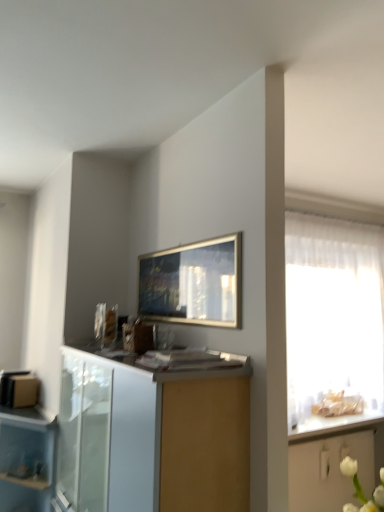
Question: Is white glossy countertop at right completely or partially inside transparent plastic drawer at lower left?

Choices:
 (A) yes
 (B) no

Answer: (B)

Question: Is transparent plastic drawer at lower left next to white glossy countertop at right?

Choices:
 (A) yes
 (B) no

Answer: (B)

Question: Does transparent plastic drawer at lower left appear on the left side of white glossy countertop at right?

Choices:
 (A) yes
 (B) no

Answer: (A)

Question: Does transparent plastic drawer at lower left come behind white glossy countertop at right?

Choices:
 (A) no
 (B) yes

Answer: (A)

Question: Does transparent plastic drawer at lower left have a greater height compared to white glossy countertop at right?

Choices:
 (A) no
 (B) yes

Answer: (B)

Question: From the image's perspective, is transparent plastic drawer at lower left under white glossy countertop at right?

Choices:
 (A) yes
 (B) no

Answer: (A)

Question: Is white glossy cabinet at lower center, the 1th cabinetry in the left-to-right sequence, smaller than white glossy countertop at right?

Choices:
 (A) yes
 (B) no

Answer: (B)

Question: Considering the relative sizes of white glossy cabinet at lower center, the second cabinetry from the bottom, and white glossy countertop at right in the image provided, is white glossy cabinet at lower center, the second cabinetry from the bottom, shorter than white glossy countertop at right?

Choices:
 (A) yes
 (B) no

Answer: (B)

Question: From the image's perspective, is white glossy cabinet at lower center, acting as the 1th cabinetry starting from the top, over white glossy countertop at right?

Choices:
 (A) yes
 (B) no

Answer: (A)

Question: Considering the relative positions of white glossy cabinet at lower center, the second cabinetry from the bottom, and white glossy countertop at right in the image provided, is white glossy cabinet at lower center, the second cabinetry from the bottom, behind white glossy countertop at right?

Choices:
 (A) no
 (B) yes

Answer: (A)

Question: Is white glossy cabinet at lower center, acting as the 1th cabinetry starting from the top, taller than white glossy countertop at right?

Choices:
 (A) no
 (B) yes

Answer: (B)

Question: Considering the relative sizes of white glossy cabinet at lower center, which appears as the 1th cabinetry when viewed from the front, and white glossy countertop at right in the image provided, is white glossy cabinet at lower center, which appears as the 1th cabinetry when viewed from the front, thinner than white glossy countertop at right?

Choices:
 (A) no
 (B) yes

Answer: (B)

Question: From a real-world perspective, is transparent plastic drawer at lower left positioned under white glossy cabinet at lower right, the second cabinetry when ordered from front to back, based on gravity?

Choices:
 (A) yes
 (B) no

Answer: (B)